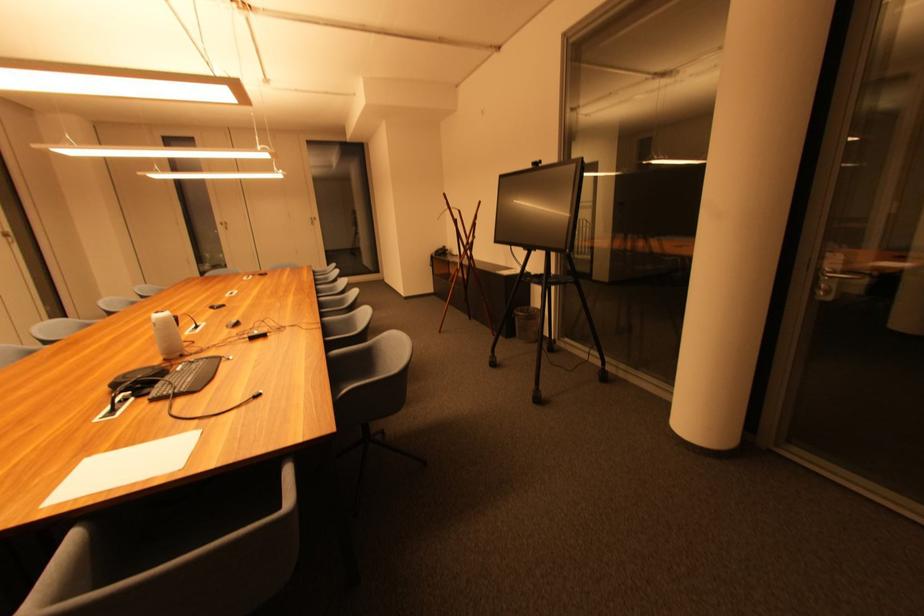
Which object does [527,323] point to?

It corresponds to the wire mesh trashcan in the image.